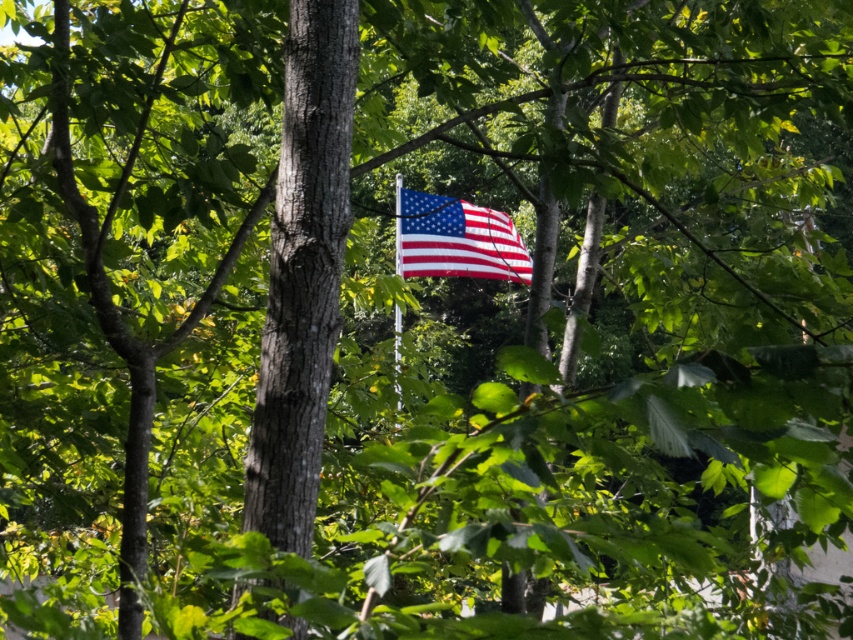
You are a photographer aiming to capture the polished cotton flag at center and the metallic silver flag pole at center. If you want to focus on the flag while keeping the pole visible in the background, which object should be closer to the camera?

The polished cotton flag at center is closer to the camera than the metallic silver flag pole at center, so focusing on it will keep the pole visible in the background.

You are a hiker navigating through the forest and want to reach a specific point. You have two coordinates to choose from. Which point is closer to you, point [476,220] or point [396,326]?

Point [476,220] is closer to you because it is further to the viewer than point [396,326].

You are a bird flying over a forest and you see a polished cotton flag at center and a metallic silver flag pole at center. Which object is shorter?

The polished cotton flag at center is shorter than the metallic silver flag pole at center.